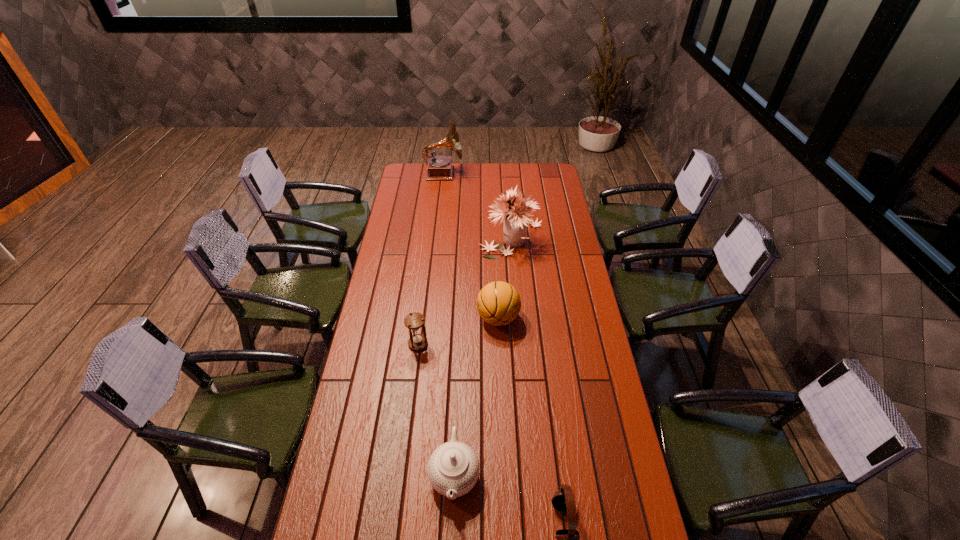
At what (x,y) coordinates should I click in order to perform the action: click on phonograph_record. Please return your answer as a coordinate pair (x, y). Looking at the image, I should click on (439, 167).

I want to click on bouquet, so click(515, 220).

This screenshot has height=540, width=960. In order to click on basketball in this screenshot , I will do `click(498, 303)`.

The image size is (960, 540). In order to click on chinaware in this screenshot , I will do `click(453, 468)`.

Locate an element on the screen. The width and height of the screenshot is (960, 540). hourglass is located at coordinates (414, 321).

Where is `free region located 0.400m on the horn of the farthest object`? free region located 0.400m on the horn of the farthest object is located at coordinates (530, 174).

Identify the location of free spot located on the left of the second farthest object. The width and height of the screenshot is (960, 540). (402, 235).

You are a GUI agent. You are given a task and a screenshot of the screen. Output one action in this format:
    pyautogui.click(x=<x>, y=<y>)
    Task: Click on the vacant space situated 0.130m on the surface of the fourth nearest object near the brand logo
    Image resolution: width=960 pixels, height=540 pixels.
    Given the screenshot: What is the action you would take?
    pyautogui.click(x=444, y=318)

Identify the location of vacant position located 0.150m on the surface of the fourth nearest object near the brand logo. (440, 318).

Where is `vacant space located on the surface of the fourth nearest object near the brand logo`? The image size is (960, 540). vacant space located on the surface of the fourth nearest object near the brand logo is located at coordinates (413, 318).